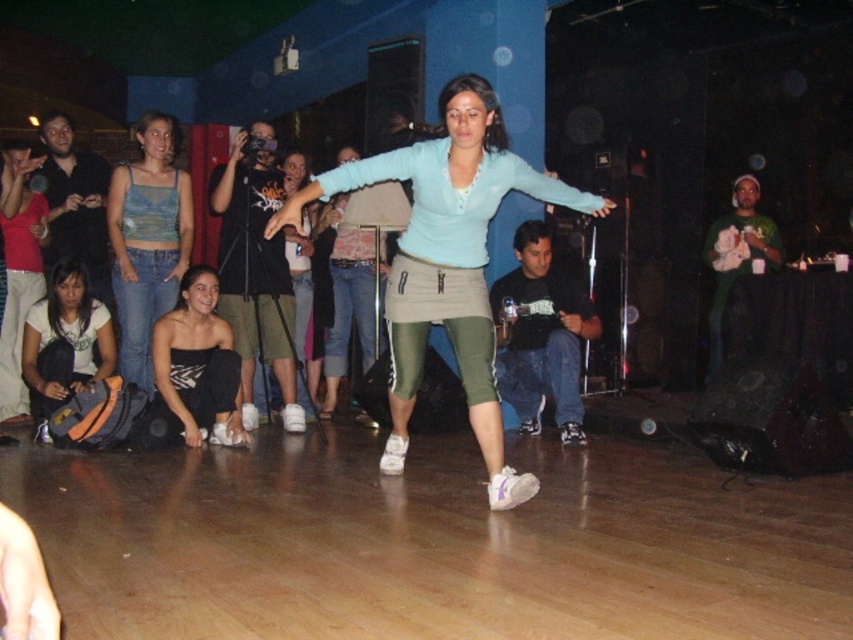
Question: Does matte black tank top at lower left appear under matte black tank top at center?

Choices:
 (A) yes
 (B) no

Answer: (A)

Question: Estimate the real-world distances between objects in this image. Which object is closer to the matte black tank top at center?

Choices:
 (A) matte black tank top at lower left
 (B) light blue denim tank top at lower left

Answer: (B)

Question: Which object is positioned farthest from the light blue denim tank top at lower left?

Choices:
 (A) matte blue sweater at center
 (B) matte black tank top at lower left
 (C) matte black tank top at center

Answer: (A)

Question: Which point appears farthest from the camera in this image?

Choices:
 (A) (389, 273)
 (B) (160, 264)
 (C) (315, 410)

Answer: (C)

Question: Can you confirm if matte blue sweater at center is smaller than matte black tank top at center?

Choices:
 (A) no
 (B) yes

Answer: (A)

Question: Where is matte black tank top at lower left located in relation to matte black tank top at center in the image?

Choices:
 (A) below
 (B) above

Answer: (A)